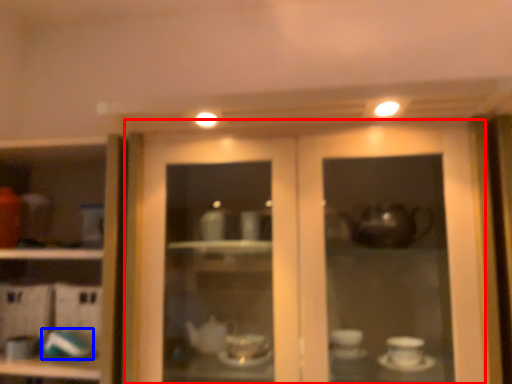
Question: Which point is closer to the camera, door (highlighted by a red box) or tableware (highlighted by a blue box)?

Choices:
 (A) door
 (B) tableware

Answer: (A)